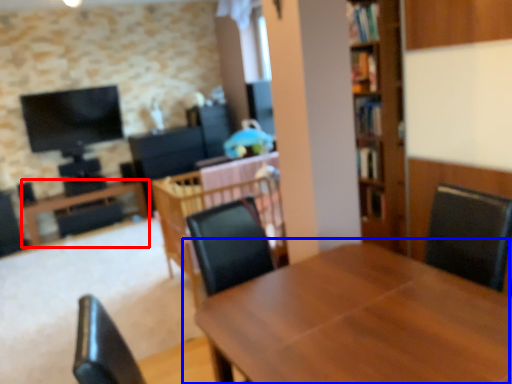
Question: Which point is further to the camera, table (highlighted by a red box) or table (highlighted by a blue box)?

Choices:
 (A) table
 (B) table

Answer: (A)